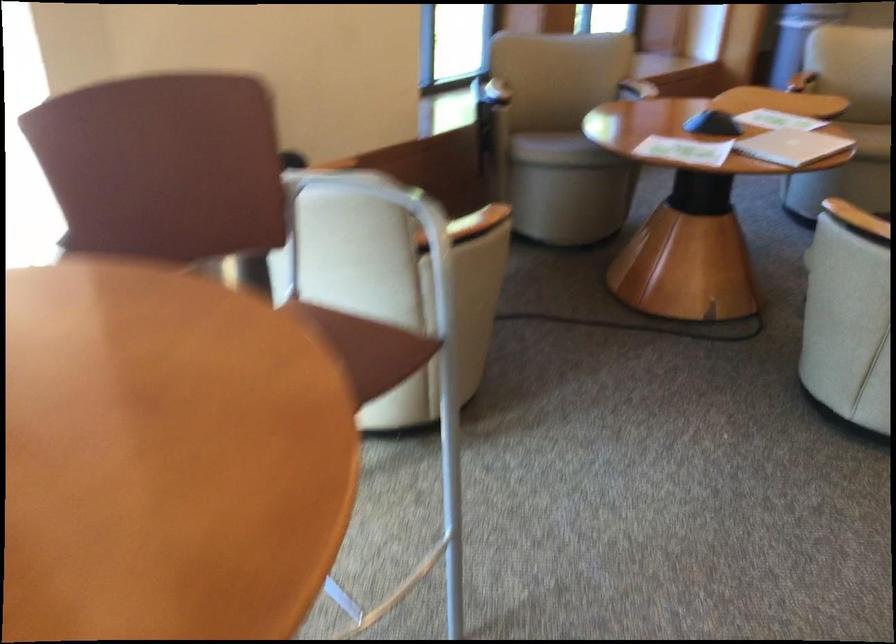
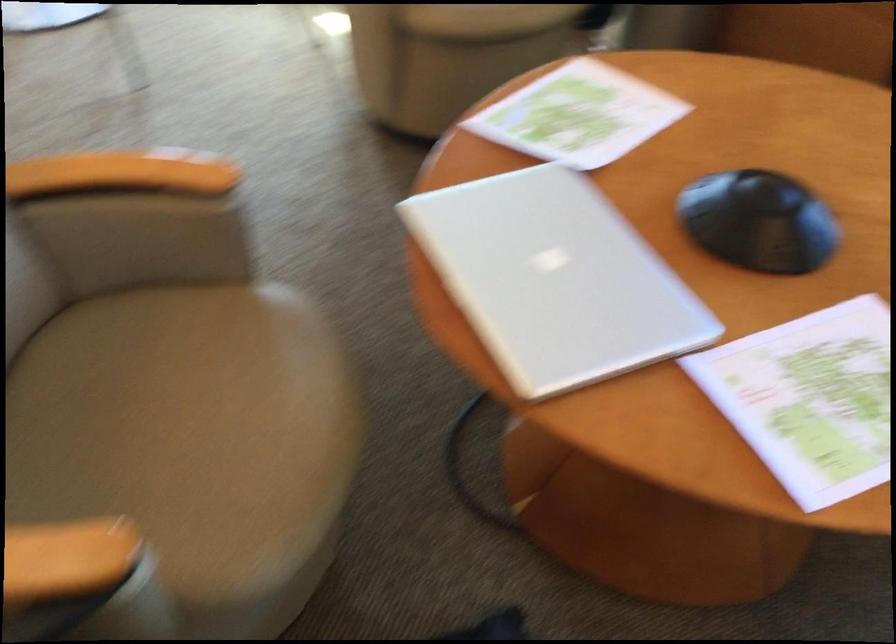
Where in the second image is the point corresponding to pixel 757 111 from the first image?

(810, 399)